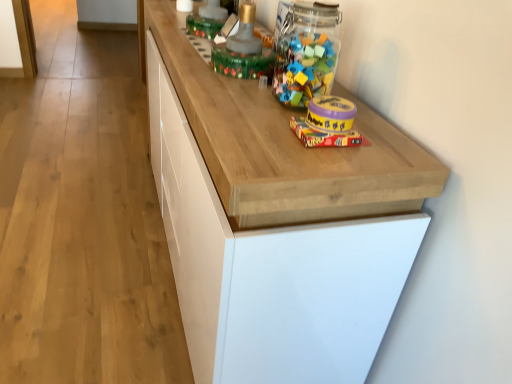
Question: Can you confirm if matte yellow plastic container at upper right, acting as the 2th toy starting from the bottom, is bigger than matte yellow plastic container at center, which ranks as the first toy in bottom-to-top order?

Choices:
 (A) yes
 (B) no

Answer: (A)

Question: Considering the relative sizes of matte yellow plastic container at upper right, positioned as the first toy in front-to-back order, and matte yellow plastic container at center, the second toy in the front-to-back sequence, in the image provided, is matte yellow plastic container at upper right, positioned as the first toy in front-to-back order, smaller than matte yellow plastic container at center, the second toy in the front-to-back sequence,?

Choices:
 (A) no
 (B) yes

Answer: (A)

Question: Is matte yellow plastic container at upper right, positioned as the first toy in front-to-back order, facing towards matte yellow plastic container at center, the second toy in the front-to-back sequence?

Choices:
 (A) yes
 (B) no

Answer: (B)

Question: Is matte yellow plastic container at center, which ranks as the first toy in bottom-to-top order, located within matte yellow plastic container at upper right, the fourth toy from the back?

Choices:
 (A) no
 (B) yes

Answer: (A)

Question: Does matte yellow plastic container at upper right, acting as the 2th toy starting from the bottom, lie in front of matte yellow plastic container at center, the second toy in the front-to-back sequence?

Choices:
 (A) no
 (B) yes

Answer: (B)

Question: Is point (349, 122) closer or farther from the camera than point (329, 112)?

Choices:
 (A) farther
 (B) closer

Answer: (A)

Question: Do you think matte yellow plastic container at upper right, which ranks as the third toy in top-to-bottom order, is within matte yellow plastic container at center, which is the third toy from back to front, or outside of it?

Choices:
 (A) inside
 (B) outside

Answer: (B)

Question: Considering the positions of matte yellow plastic container at upper right, acting as the 2th toy starting from the bottom, and matte yellow plastic container at center, which is the fourth toy from top to bottom, in the image, is matte yellow plastic container at upper right, acting as the 2th toy starting from the bottom, wider or thinner than matte yellow plastic container at center, which is the fourth toy from top to bottom,?

Choices:
 (A) thin
 (B) wide

Answer: (A)

Question: In terms of height, does matte yellow plastic container at upper right, acting as the 2th toy starting from the bottom, look taller or shorter compared to matte yellow plastic container at center, which is the fourth toy from top to bottom?

Choices:
 (A) tall
 (B) short

Answer: (A)

Question: From the image's perspective, is matte yellow plastic container at upper right, which ranks as the third toy in top-to-bottom order, positioned above or below translucent plastic container at upper center, which is counted as the first toy, starting from the top?

Choices:
 (A) below
 (B) above

Answer: (A)

Question: From a real-world perspective, is matte yellow plastic container at upper right, the fourth toy from the back, positioned above or below translucent plastic container at upper center, which is counted as the first toy, starting from the top?

Choices:
 (A) below
 (B) above

Answer: (A)

Question: In the image, is matte yellow plastic container at upper right, acting as the 2th toy starting from the bottom, on the left side or the right side of translucent plastic container at upper center, which is the first toy from back to front?

Choices:
 (A) left
 (B) right

Answer: (B)

Question: Is point (313, 102) positioned closer to the camera than point (203, 13)?

Choices:
 (A) farther
 (B) closer

Answer: (B)

Question: Looking at their shapes, would you say wooden cabinet at center is wider or thinner than translucent plastic container at upper center, which is counted as the first toy, starting from the top?

Choices:
 (A) thin
 (B) wide

Answer: (B)

Question: From the image's perspective, is wooden cabinet at center located above or below translucent plastic container at upper center, which is the first toy from back to front?

Choices:
 (A) above
 (B) below

Answer: (B)